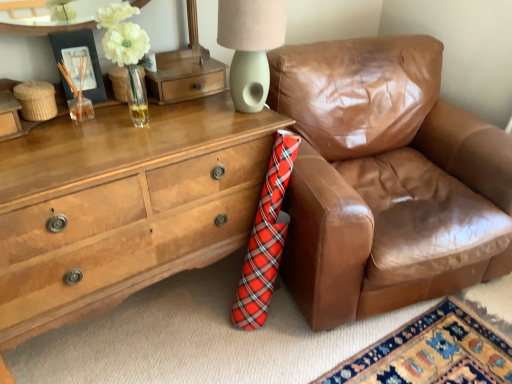
Where is `free space to the left of matte green ceramic lampshade at upper center`? This screenshot has width=512, height=384. free space to the left of matte green ceramic lampshade at upper center is located at coordinates coord(190,113).